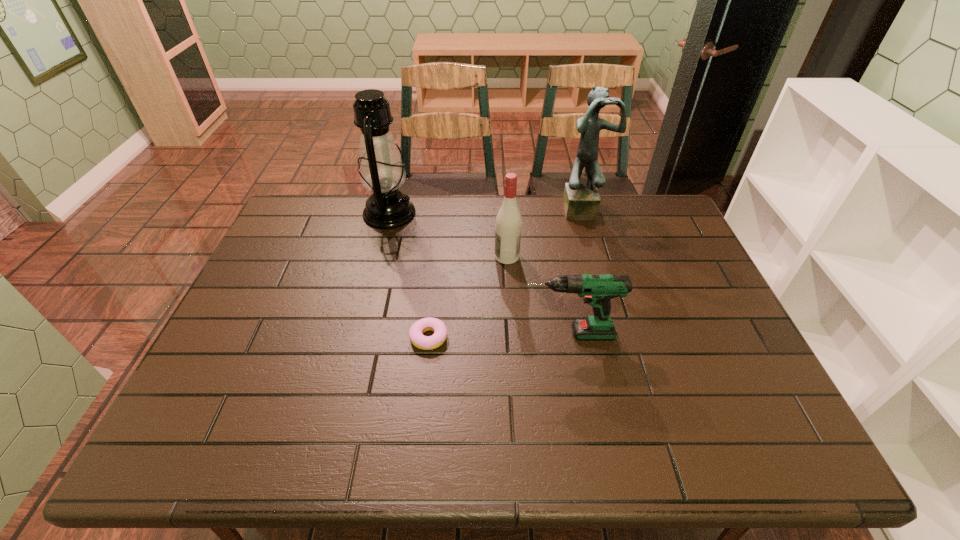
Where is `vacant area situated 0.340m on the label of the alcohol`? The height and width of the screenshot is (540, 960). vacant area situated 0.340m on the label of the alcohol is located at coordinates (385, 256).

This screenshot has height=540, width=960. In order to click on free space located on the label of the alcohol in this screenshot , I will do `click(466, 256)`.

In order to click on free spot located 0.110m on the handle side of the fourth tallest object in this screenshot , I will do `click(480, 334)`.

The height and width of the screenshot is (540, 960). Identify the location of free region located 0.150m on the handle side of the fourth tallest object. (465, 334).

The height and width of the screenshot is (540, 960). In order to click on blank space located on the handle side of the fourth tallest object in this screenshot , I will do `click(387, 334)`.

The width and height of the screenshot is (960, 540). I want to click on free space located on the right of the shortest object, so click(474, 339).

This screenshot has height=540, width=960. I want to click on oil lamp present at the far edge, so click(x=381, y=169).

Locate an element on the screen. sculpture that is at the far edge is located at coordinates (581, 201).

This screenshot has width=960, height=540. In the image, there is a desktop. Identify the location of free space at the far edge. (455, 225).

Locate an element on the screen. Image resolution: width=960 pixels, height=540 pixels. vacant space at the near edge of the desktop is located at coordinates (379, 436).